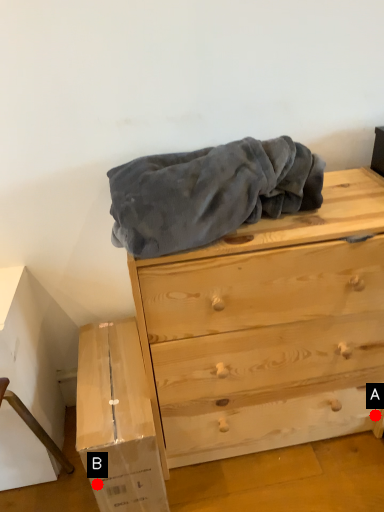
Question: Two points are circled on the image, labeled by A and B beside each circle. Which point is closer to the camera?

Choices:
 (A) A is closer
 (B) B is closer

Answer: (B)